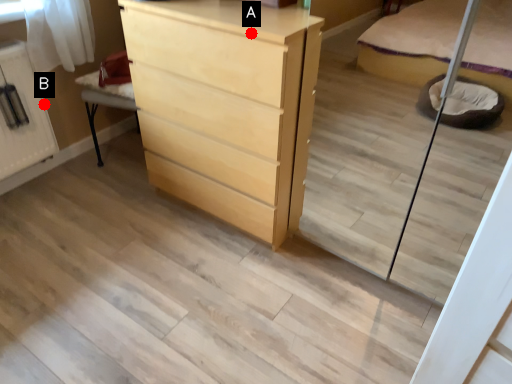
Question: Two points are circled on the image, labeled by A and B beside each circle. Which point is closer to the camera?

Choices:
 (A) A is closer
 (B) B is closer

Answer: (A)